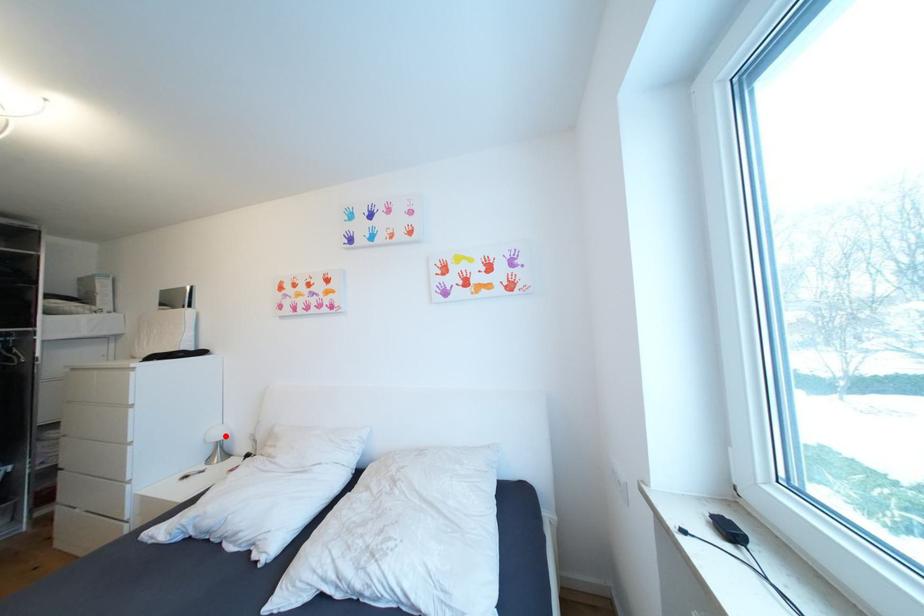
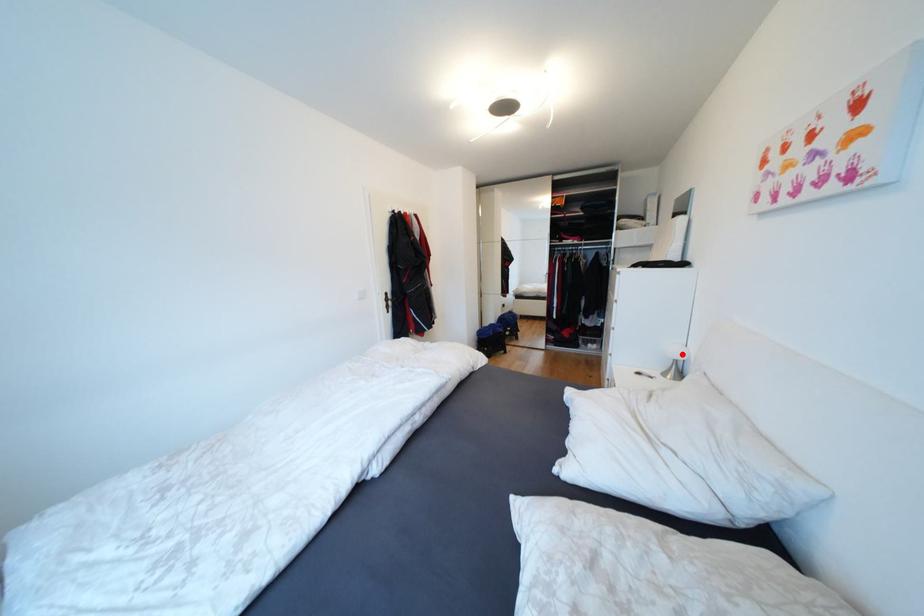
I am providing you with two images of the same scene from different viewpoints. A red point is marked on the first image and another point is marked on the second image. Is the red point in image1 aligned with the point shown in image2?

Yes